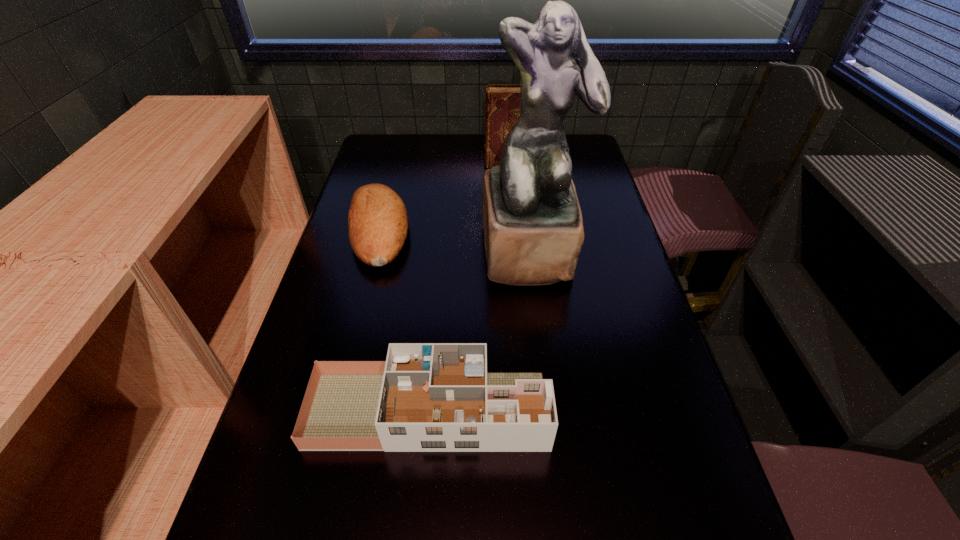
Identify the location of free point that satisfies the following two spatial constraints: 1. in a relaxed pose on the tallest object; 2. at the front door of the dollhouse. This screenshot has width=960, height=540. [549, 410].